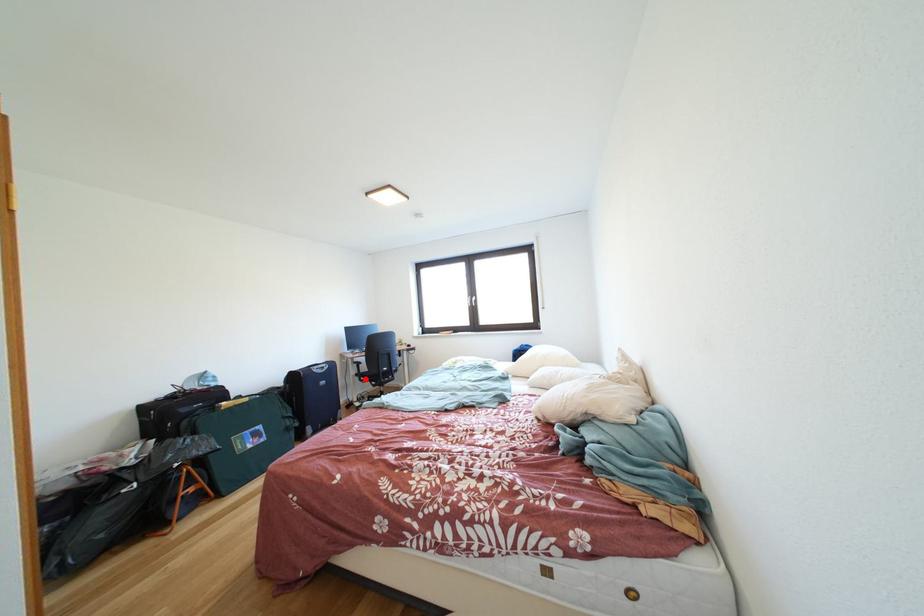
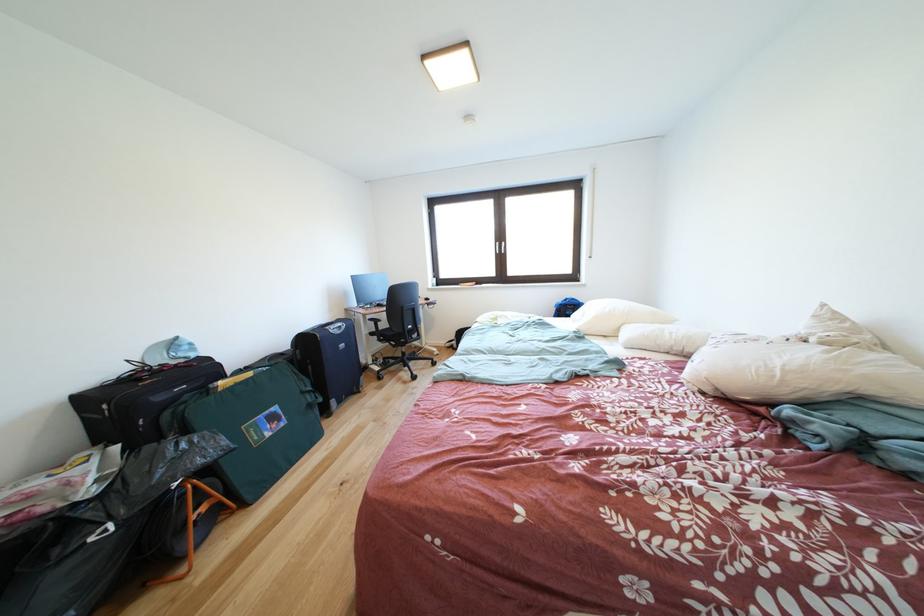
Question: I am providing you with two images of the same scene from different viewpoints. A red point is marked on the first image. Can you still see the location of the red point in image 2?

Choices:
 (A) Yes
 (B) No

Answer: (A)